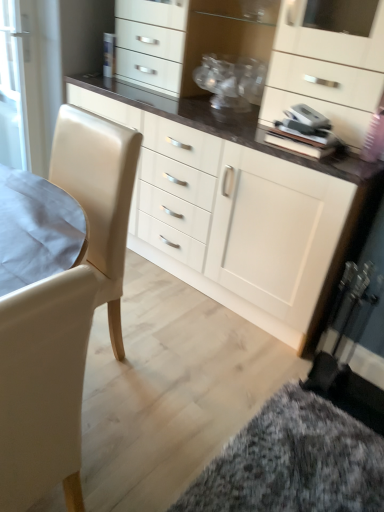
Question: Visually, is leather-like white swivel chair at left positioned to the left or to the right of fluffy carpet at lower right?

Choices:
 (A) right
 (B) left

Answer: (B)

Question: In terms of height, does leather-like white swivel chair at left look taller or shorter compared to fluffy carpet at lower right?

Choices:
 (A) tall
 (B) short

Answer: (A)

Question: Considering the real-world distances, which object is farthest from the matte white cabinet at center?

Choices:
 (A) leather-like white swivel chair at left
 (B) fluffy carpet at lower right
 (C) beige leather chair at left

Answer: (C)

Question: Which is nearer to the beige leather chair at left?

Choices:
 (A) fluffy carpet at lower right
 (B) leather-like white swivel chair at left
 (C) matte white cabinet at center

Answer: (B)